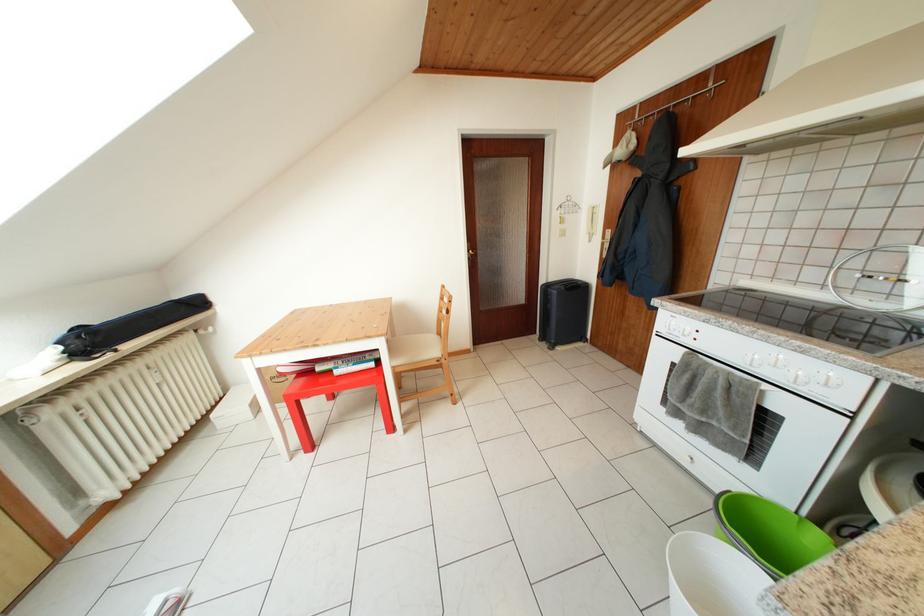
What are the coordinates of `telephone handset` in the screenshot? It's located at (592, 217).